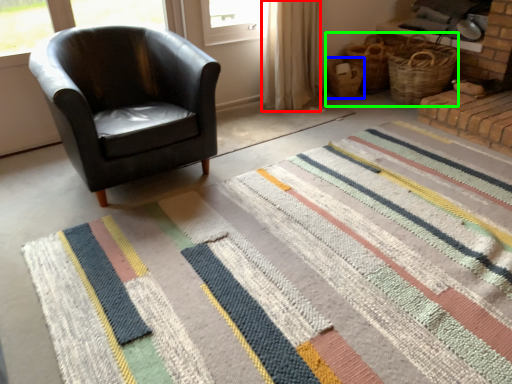
Question: Estimate the real-world distances between objects in this image. Which object is farther from curtain (highlighted by a red box), basket (highlighted by a blue box) or basket (highlighted by a green box)?

Choices:
 (A) basket
 (B) basket

Answer: (B)